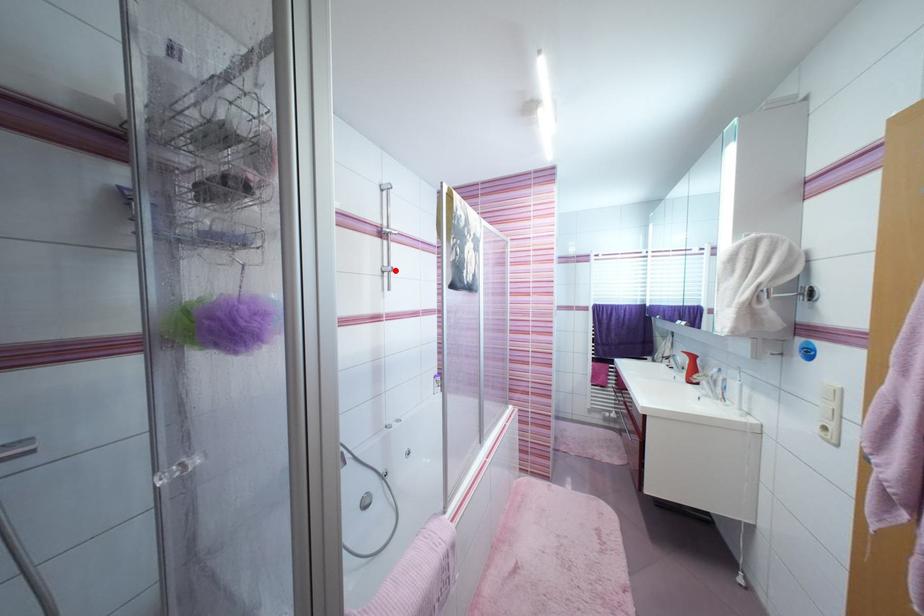
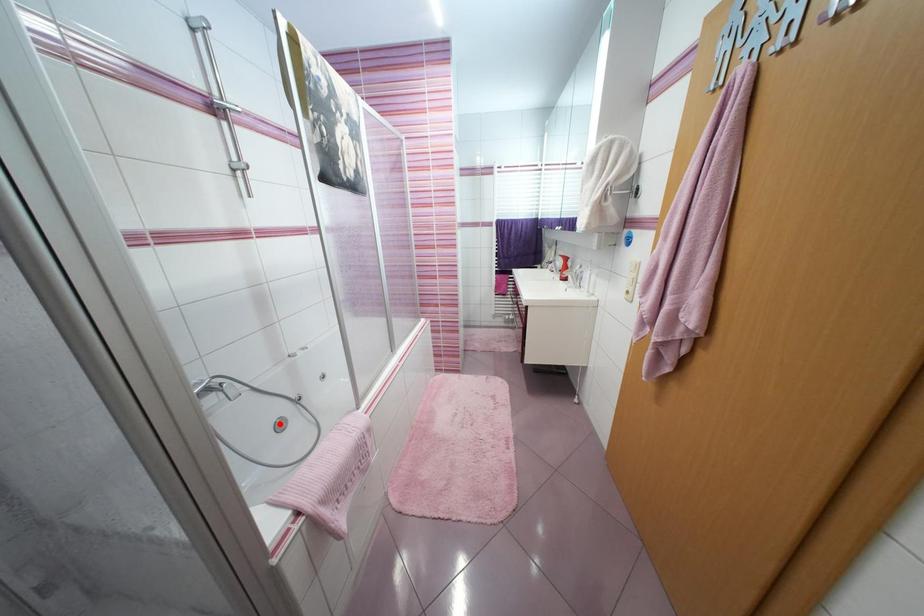
I am providing you with two images of the same scene from different viewpoints. A red point is marked on the first image and another point is marked on the second image. Does the point marked in image1 correspond to the same location as the one in image2?

No